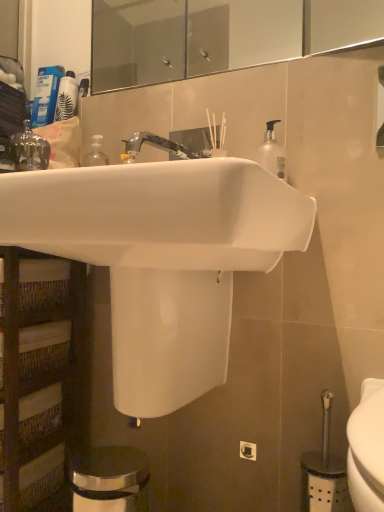
Question: Does gold metallic crown at upper left have a greater width compared to white glossy sink at center?

Choices:
 (A) no
 (B) yes

Answer: (A)

Question: From a real-world perspective, is gold metallic crown at upper left over white glossy sink at center?

Choices:
 (A) yes
 (B) no

Answer: (A)

Question: Can you confirm if gold metallic crown at upper left is bigger than white glossy sink at center?

Choices:
 (A) yes
 (B) no

Answer: (B)

Question: Does gold metallic crown at upper left lie behind white glossy sink at center?

Choices:
 (A) no
 (B) yes

Answer: (B)

Question: Is gold metallic crown at upper left in contact with white glossy sink at center?

Choices:
 (A) yes
 (B) no

Answer: (B)

Question: Is gold metallic crown at upper left not close to white glossy sink at center?

Choices:
 (A) yes
 (B) no

Answer: (B)

Question: Could you tell me if white glossy sink at center is turned towards gold metallic crown at upper left?

Choices:
 (A) no
 (B) yes

Answer: (A)

Question: Considering the relative positions of white glossy sink at center and gold metallic crown at upper left in the image provided, is white glossy sink at center to the right of gold metallic crown at upper left from the viewer's perspective?

Choices:
 (A) yes
 (B) no

Answer: (A)

Question: Is white glossy sink at center outside of gold metallic crown at upper left?

Choices:
 (A) yes
 (B) no

Answer: (A)

Question: Is white glossy sink at center bigger than gold metallic crown at upper left?

Choices:
 (A) no
 (B) yes

Answer: (B)

Question: Can you confirm if white glossy sink at center is wider than gold metallic crown at upper left?

Choices:
 (A) no
 (B) yes

Answer: (B)

Question: Is gold metallic crown at upper left surrounded by white glossy sink at center?

Choices:
 (A) no
 (B) yes

Answer: (A)

Question: From a real-world perspective, is white glossy sink at center on top of compact blue lotion at upper left?

Choices:
 (A) yes
 (B) no

Answer: (B)